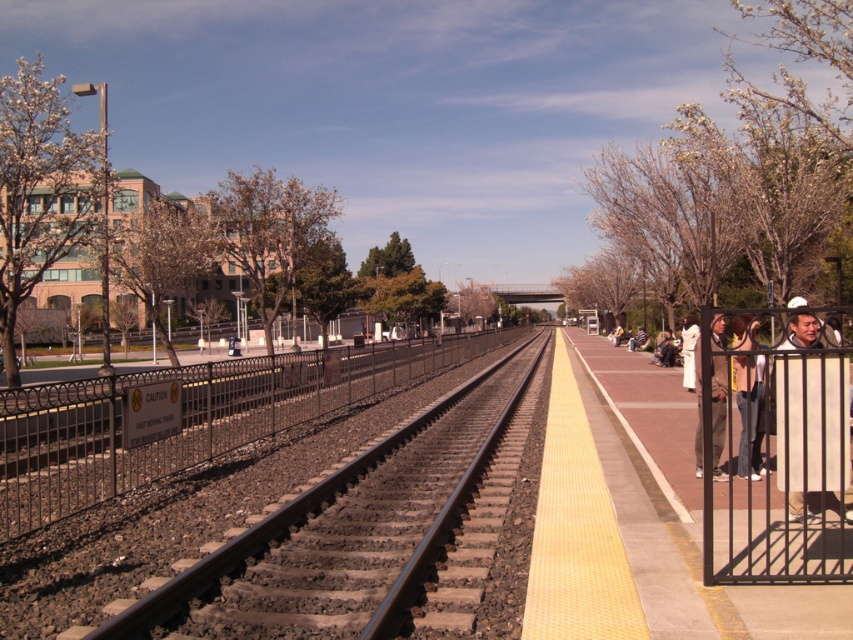
Between black metal fence at right and denim pants at right, which one appears on the right side from the viewer's perspective?

black metal fence at right is more to the right.

Measure the distance between point (717,429) and camera.

They are 7.99 meters apart.

Where is `black metal fence at right`? black metal fence at right is located at coordinates (779, 449).

Does denim pants at right come in front of khaki pants at right?

Yes, it is in front of khaki pants at right.

Is denim pants at right thinner than khaki pants at right?

Incorrect, denim pants at right's width is not less than khaki pants at right's.

Identify the location of denim pants at right. (747, 412).

Where is `denim pants at right`? This screenshot has height=640, width=853. denim pants at right is located at coordinates (747, 412).

Who is more forward, (701,449) or (697,321)?

Point (701,449) is more forward.

Describe the element at coordinates (718, 412) in the screenshot. I see `khaki pants at right` at that location.

Find the location of a particular element. khaki pants at right is located at coordinates (718, 412).